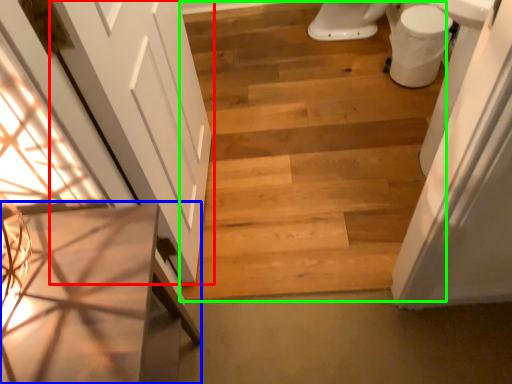
Question: Based on their relative distances, which object is nearer to door (highlighted by a red box)? Choose from vanity (highlighted by a blue box) and stairwell (highlighted by a green box).

Choices:
 (A) vanity
 (B) stairwell

Answer: (A)